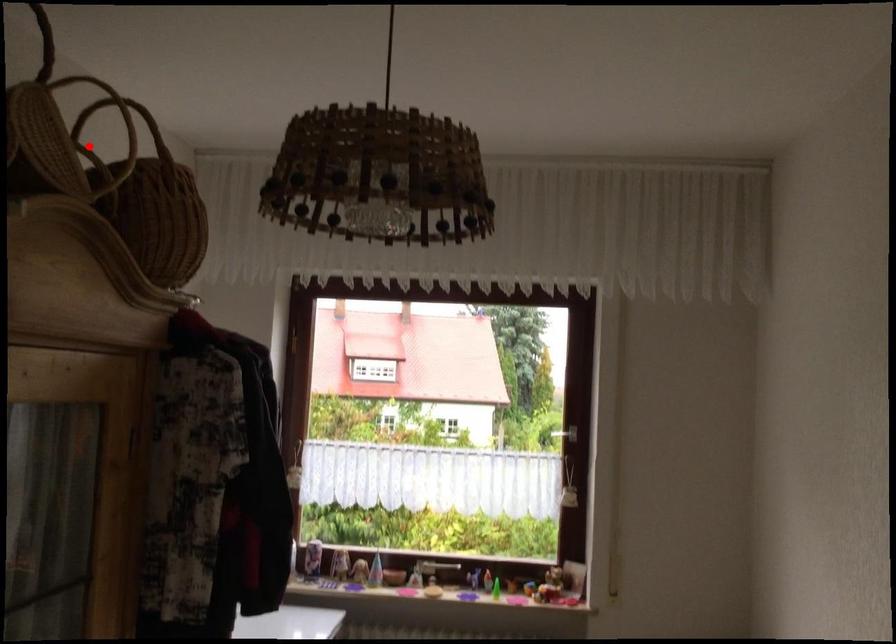
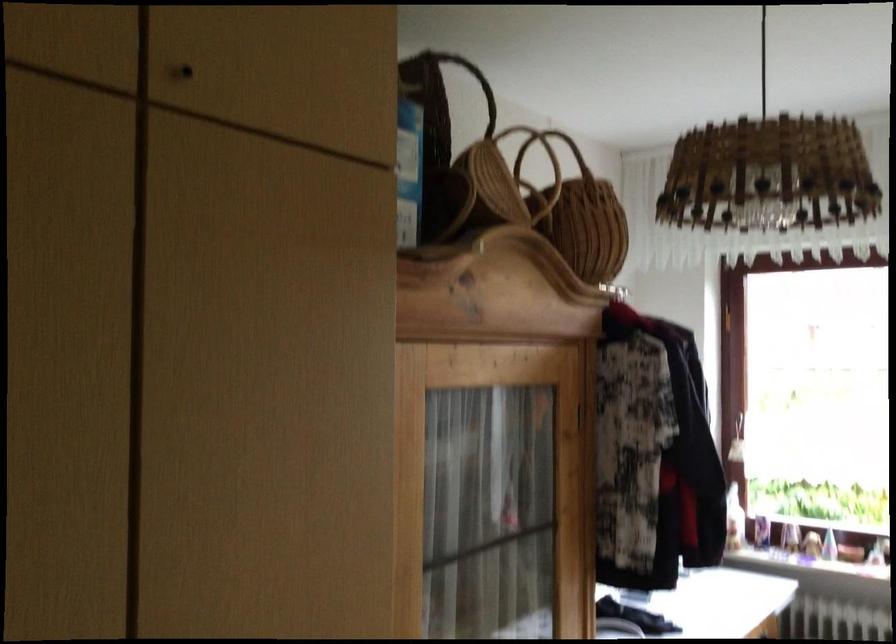
Where in the second image is the point corresponding to the highlighted location from the first image?

(533, 169)